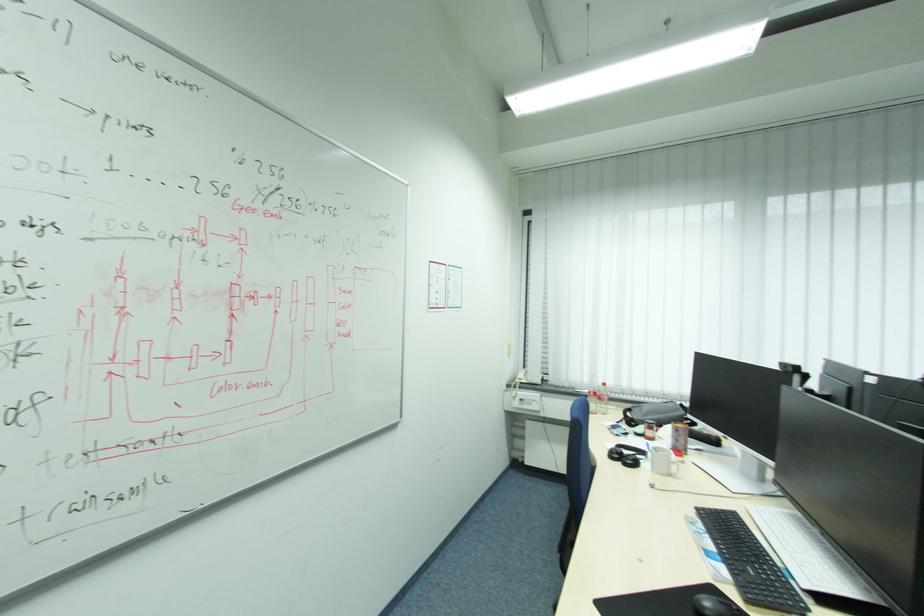
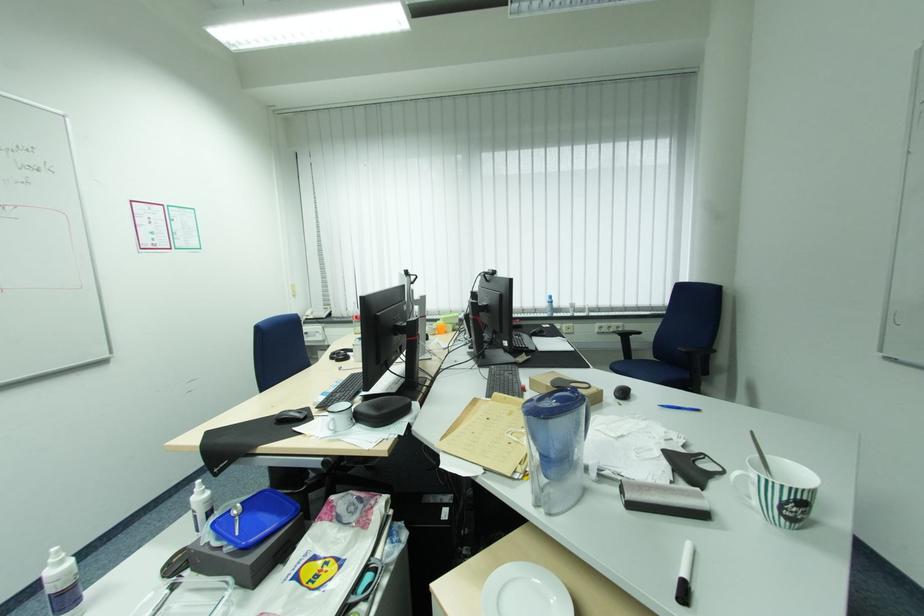
What movement of the cameraman would produce the second image?

The cameraman moved toward right, backward.